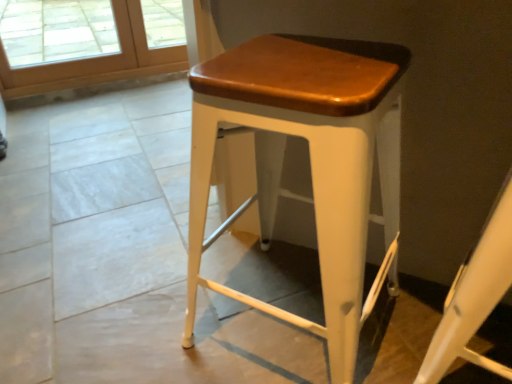
Question: Considering the positions of point (126, 18) and point (501, 251), is point (126, 18) closer or farther from the camera than point (501, 251)?

Choices:
 (A) farther
 (B) closer

Answer: (A)

Question: Relative to white matte stool at center, is wooden screen door at upper left in front or behind?

Choices:
 (A) behind
 (B) front

Answer: (A)

Question: Estimate the real-world distances between objects in this image. Which object is closer to the wooden screen door at upper left?

Choices:
 (A) white matte stool at center
 (B) matte white stool at center

Answer: (B)

Question: Based on their relative distances, which object is nearer to the matte white stool at center?

Choices:
 (A) white matte stool at center
 (B) wooden screen door at upper left

Answer: (A)